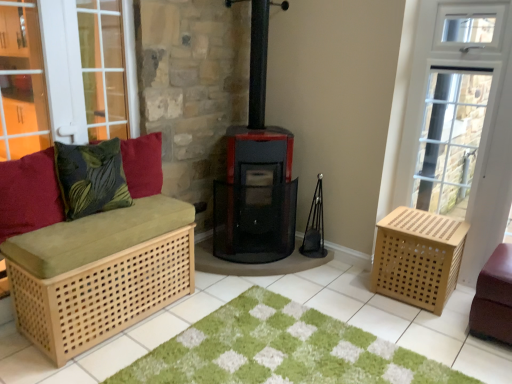
The height and width of the screenshot is (384, 512). Identify the location of free location in front of natural wood crate at right. (429, 327).